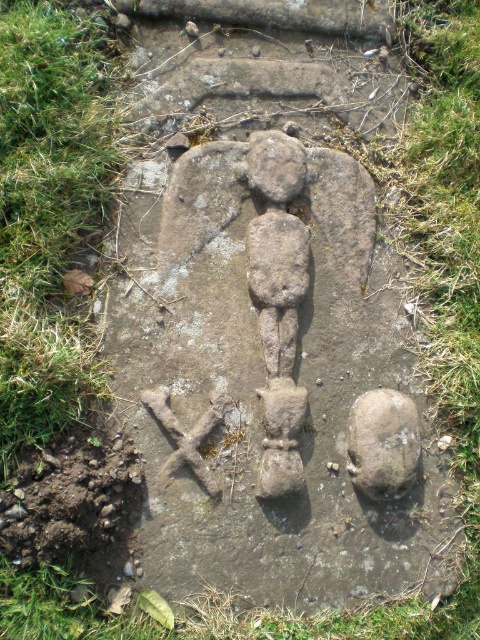
From the picture: You are standing on the green grass at lower left and want to reach the rusty stone at lower right. Which direction should you move to get there?

You should move towards the direction of the rusty stone at lower right since the green grass at lower left is in front of it, meaning the stone is behind you relative to your current position.